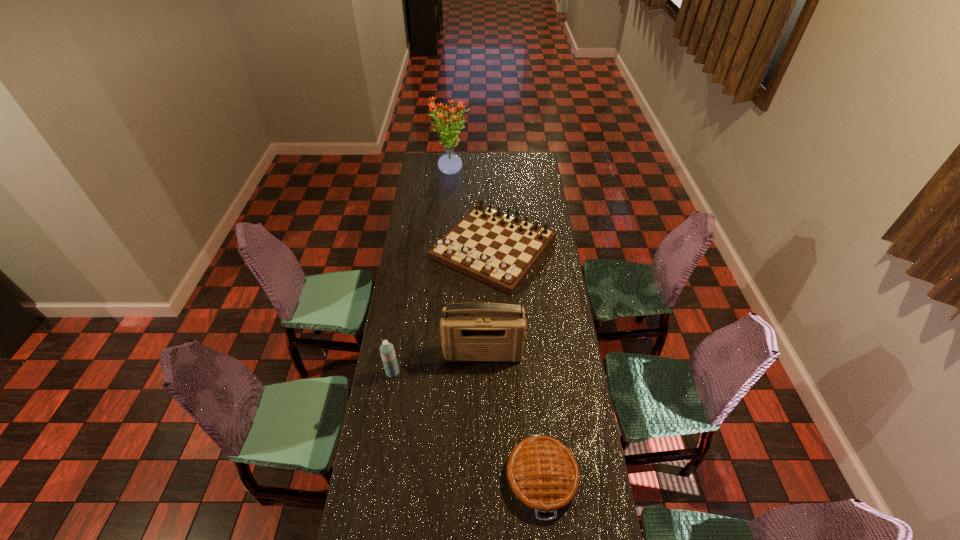
Image resolution: width=960 pixels, height=540 pixels. I want to click on vacant space in between the farthest object and the water bottle, so click(422, 273).

In order to click on empty space between the pie and the third farthest object in this screenshot , I will do `click(513, 415)`.

Identify the location of vacant space that is in between the third farthest object and the second farthest object. (489, 301).

The height and width of the screenshot is (540, 960). Identify the location of object that is the third nearest to the water bottle. (542, 472).

This screenshot has height=540, width=960. In order to click on object that ranks as the second closest to the leftmost object in this screenshot , I will do `click(499, 249)`.

Locate an element on the screen. The height and width of the screenshot is (540, 960). vacant position in the image that satisfies the following two spatial constraints: 1. on the front side of the flower arrangement; 2. on the left side of the shortest object is located at coordinates (427, 477).

At what (x,y) coordinates should I click in order to perform the action: click on vacant position in the image that satisfies the following two spatial constraints: 1. on the front-facing side of the shortest object; 2. on the left side of the fourth shortest object. Please return your answer as a coordinate pair (x, y). Looking at the image, I should click on (484, 477).